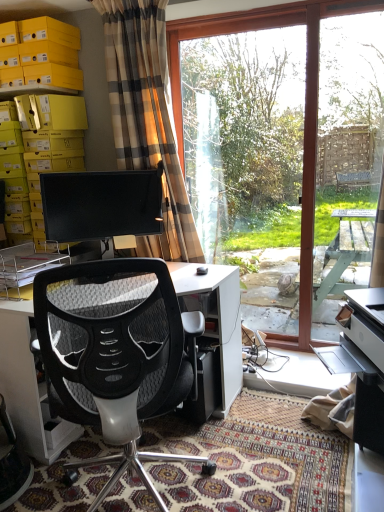
Question: From a real-world perspective, is white glossy printer at lower right positioned above or below transparent glass screen door at right?

Choices:
 (A) below
 (B) above

Answer: (A)

Question: Considering the relative positions of white glossy printer at lower right and transparent glass screen door at right in the image provided, is white glossy printer at lower right to the left or to the right of transparent glass screen door at right?

Choices:
 (A) left
 (B) right

Answer: (A)

Question: Which is farther from the white glossy printer at lower right?

Choices:
 (A) black glossy monitor at center
 (B) black mesh chair at center
 (C) transparent glass screen door at right
 (D) plaid fabric curtain at upper left
 (E) yellow cardboard boxes at upper left

Answer: (E)

Question: Which of these objects is positioned farthest from the transparent glass window at center?

Choices:
 (A) yellow cardboard boxes at upper left
 (B) plaid fabric curtain at upper left
 (C) black glossy monitor at center
 (D) black mesh chair at center
 (E) white glossy printer at lower right

Answer: (D)